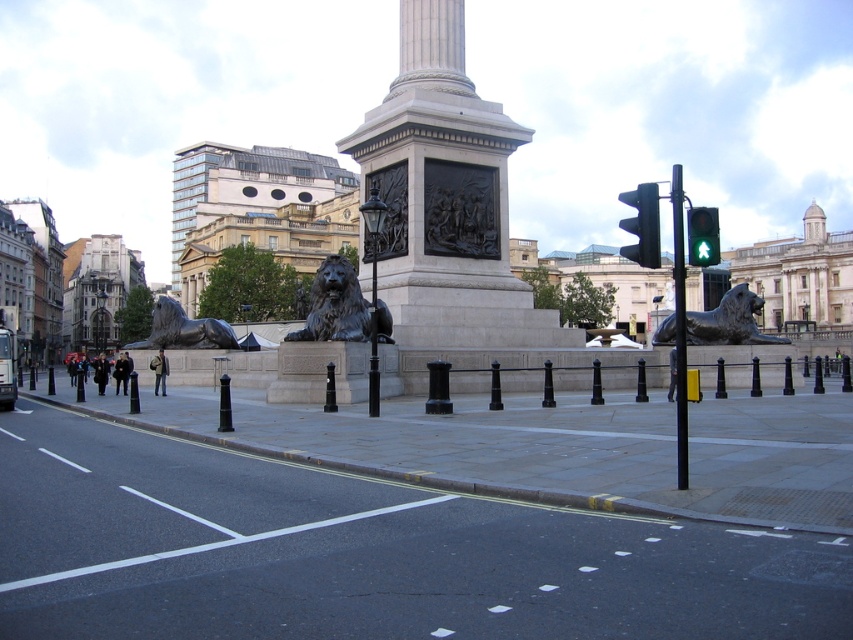
Question: Which point is closer to the camera?

Choices:
 (A) black glass traffic light at upper right
 (B) smooth stone plaza at center
 (C) bronze lion at center

Answer: (B)

Question: Does shiny silver lion at right appear under bronze lion at left?

Choices:
 (A) no
 (B) yes

Answer: (B)

Question: Is black metal pole at right thinner than bronze lion at left?

Choices:
 (A) no
 (B) yes

Answer: (A)

Question: Which of the following is the closest to the observer?

Choices:
 (A) (433, 604)
 (B) (221, 420)
 (C) (368, 232)
 (D) (751, 321)

Answer: (A)

Question: Can you confirm if bronze lion at center is positioned to the right of shiny silver lion at right?

Choices:
 (A) no
 (B) yes

Answer: (A)

Question: Which point is closer to the camera?

Choices:
 (A) bronze lion at center
 (B) shiny silver lion at right
 (C) black metal pole at right

Answer: (C)